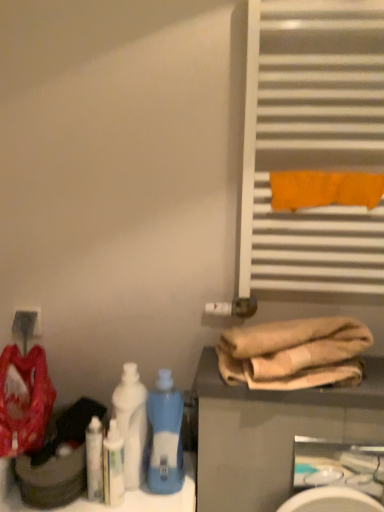
Question: From a real-world perspective, is blue plastic bottle at center, which is counted as the first bottle, starting from the right, over white metallic radiator at upper right?

Choices:
 (A) yes
 (B) no

Answer: (B)

Question: Is blue plastic bottle at center, which is counted as the first bottle, starting from the right, located outside white metallic radiator at upper right?

Choices:
 (A) yes
 (B) no

Answer: (A)

Question: Does blue plastic bottle at center, which is counted as the first bottle, starting from the right, have a greater width compared to white metallic radiator at upper right?

Choices:
 (A) no
 (B) yes

Answer: (B)

Question: Can white metallic radiator at upper right be found inside blue plastic bottle at center, the second bottle when ordered from left to right?

Choices:
 (A) yes
 (B) no

Answer: (B)

Question: From the image's perspective, is blue plastic bottle at center, the second bottle when ordered from left to right, under white metallic radiator at upper right?

Choices:
 (A) no
 (B) yes

Answer: (B)

Question: Is blue plastic bottle at center, which is counted as the first bottle, starting from the right, looking in the opposite direction of white metallic radiator at upper right?

Choices:
 (A) no
 (B) yes

Answer: (A)

Question: Does matte red fabric at left lie in front of white glossy sink at lower right?

Choices:
 (A) no
 (B) yes

Answer: (B)

Question: From a real-world perspective, is matte red fabric at left located beneath white glossy sink at lower right?

Choices:
 (A) yes
 (B) no

Answer: (B)

Question: From a real-world perspective, is matte red fabric at left on white glossy sink at lower right?

Choices:
 (A) yes
 (B) no

Answer: (A)

Question: Considering the relative sizes of matte red fabric at left and white glossy sink at lower right in the image provided, is matte red fabric at left shorter than white glossy sink at lower right?

Choices:
 (A) no
 (B) yes

Answer: (A)

Question: Can you confirm if matte red fabric at left is smaller than white glossy sink at lower right?

Choices:
 (A) yes
 (B) no

Answer: (B)

Question: Is matte red fabric at left oriented towards white glossy sink at lower right?

Choices:
 (A) yes
 (B) no

Answer: (B)

Question: Can you confirm if matte white electric outlet at lower left is thinner than beige cotton towels at lower right?

Choices:
 (A) no
 (B) yes

Answer: (B)